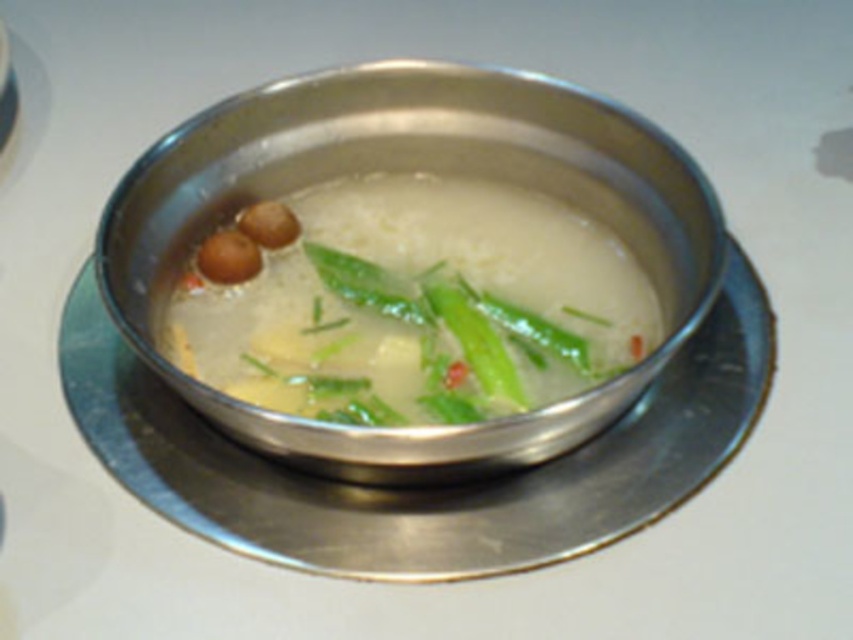
You are a chef trying to locate two specific points in the image of the soup bowl. The first point is at coordinates point (602, 136) and the second is at point (383, 410). Which point is closer to the viewer?

Point (383, 410) is closer to the viewer because point (602, 136) is behind it.

You are a chef preparing a soup and need to place a garnish at the exact center of the satin silver bowl at center. Given that the bowl is placed at point (412, 170), where should you place the garnish?

The exact center of the satin silver bowl at center is at point (412, 170), so you should place the garnish there.